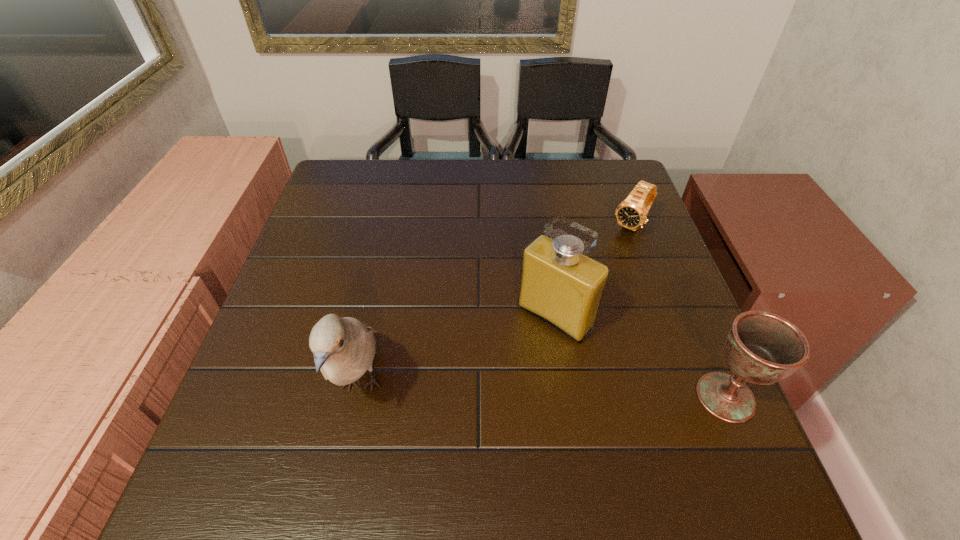
Find the location of a particular element. Image resolution: width=960 pixels, height=540 pixels. free location at the far left corner of the desktop is located at coordinates (329, 185).

In the image, there is a desktop. Where is `vacant space at the far right corner`? The height and width of the screenshot is (540, 960). vacant space at the far right corner is located at coordinates (612, 192).

At what (x,y) coordinates should I click in order to perform the action: click on vacant space at the near right corner of the desktop. Please return your answer as a coordinate pair (x, y). The image size is (960, 540). Looking at the image, I should click on (706, 418).

Locate an element on the screen. This screenshot has width=960, height=540. unoccupied position between the third tallest object and the leftmost object is located at coordinates pos(543,391).

Locate an element on the screen. The image size is (960, 540). free point between the leftmost object and the chalice is located at coordinates (543, 391).

Where is `empty location between the leftmost object and the watch`? empty location between the leftmost object and the watch is located at coordinates (496, 305).

Where is `unoccupied position between the shortest object and the bird`? The image size is (960, 540). unoccupied position between the shortest object and the bird is located at coordinates (496, 305).

Find the location of a particular element. The width and height of the screenshot is (960, 540). vacant space in between the bird and the third object from right to left is located at coordinates (458, 351).

Identify the location of vacant area between the leftmost object and the watch. (496, 305).

Select which object is the closest to the third tallest object. Please provide its 2D coordinates. Your answer should be formatted as a tuple, i.e. [(x, y)], where the tuple contains the x and y coordinates of a point satisfying the conditions above.

[(559, 284)]